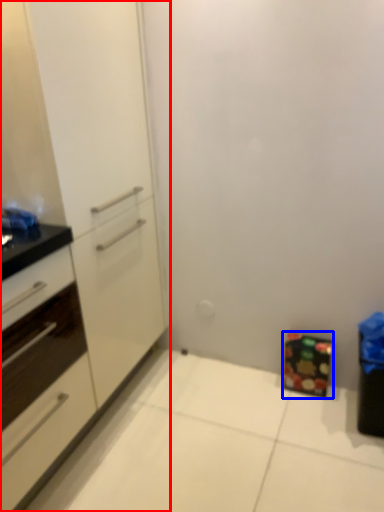
Question: Which point is further to the camera, cabinetry (highlighted by a red box) or cabinetry (highlighted by a blue box)?

Choices:
 (A) cabinetry
 (B) cabinetry

Answer: (B)